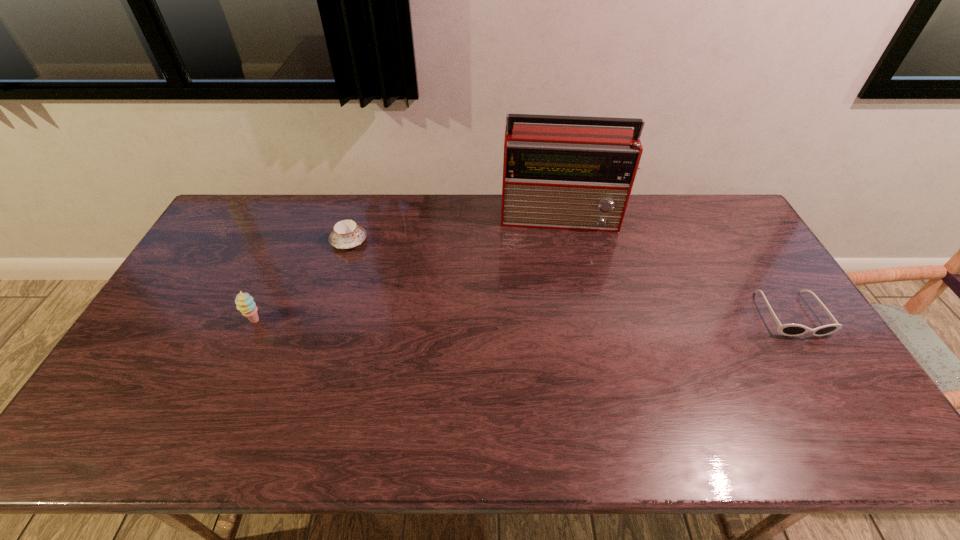
This screenshot has height=540, width=960. Find the location of `vacant space located on the front-facing side of the tallest object`. vacant space located on the front-facing side of the tallest object is located at coordinates (564, 312).

You are a GUI agent. You are given a task and a screenshot of the screen. Output one action in this format:
    pyautogui.click(x=<x>, y=<y>)
    Task: Click on the vacant region located 0.320m on the front-facing side of the tallest object
    The height and width of the screenshot is (540, 960).
    Given the screenshot: What is the action you would take?
    pyautogui.click(x=564, y=304)

Find the location of a particular element. This screenshot has height=540, width=960. vacant space situated 0.400m on the front-facing side of the tallest object is located at coordinates (565, 325).

Identify the location of free space located 0.060m on the side with the handle of the third tallest object. [375, 255].

Locate an element on the screen. The height and width of the screenshot is (540, 960). vacant space situated on the side with the handle of the third tallest object is located at coordinates (446, 291).

You are a GUI agent. You are given a task and a screenshot of the screen. Output one action in this format:
    pyautogui.click(x=<x>, y=<y>)
    Task: Click on the vacant space situated 0.080m on the side with the handle of the third tallest object
    
    Given the screenshot: What is the action you would take?
    pyautogui.click(x=380, y=257)

What are the coordinates of `radio receiver positioned at the far edge` in the screenshot? It's located at (568, 177).

At what (x,y) coordinates should I click in order to perform the action: click on teacup located at the far edge. Please return your answer as a coordinate pair (x, y). The image size is (960, 540). Looking at the image, I should click on (347, 234).

The height and width of the screenshot is (540, 960). What are the coordinates of `object located at the right edge` in the screenshot? It's located at (787, 329).

Where is `vacant space at the far edge of the desktop`? vacant space at the far edge of the desktop is located at coordinates (500, 221).